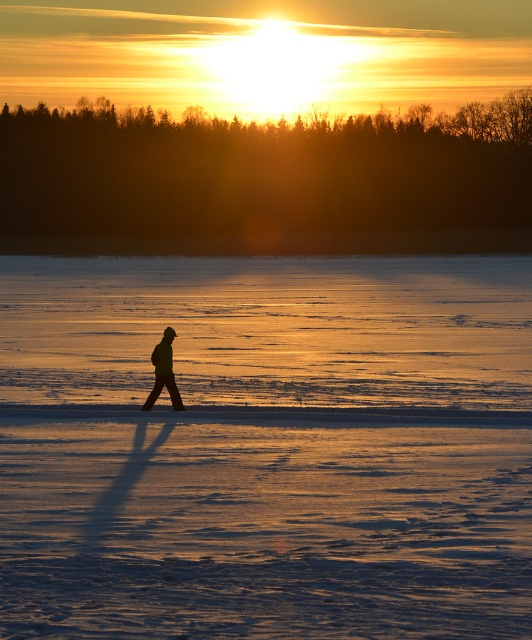
Question: Which point is farther to the camera?

Choices:
 (A) (408, 472)
 (B) (159, 364)

Answer: (B)

Question: Can you confirm if smooth ice at center is positioned above silhouette jacket at center?

Choices:
 (A) yes
 (B) no

Answer: (A)

Question: Which point appears closest to the camera in this image?

Choices:
 (A) (153, 390)
 (B) (30, 396)

Answer: (A)

Question: Can you confirm if smooth ice at center is positioned to the left of silhouette jacket at center?

Choices:
 (A) no
 (B) yes

Answer: (A)

Question: Can you confirm if smooth ice at center is wider than silhouette jacket at center?

Choices:
 (A) yes
 (B) no

Answer: (A)

Question: Which point is farther to the camera?

Choices:
 (A) silhouette jacket at center
 (B) smooth ice at center

Answer: (A)